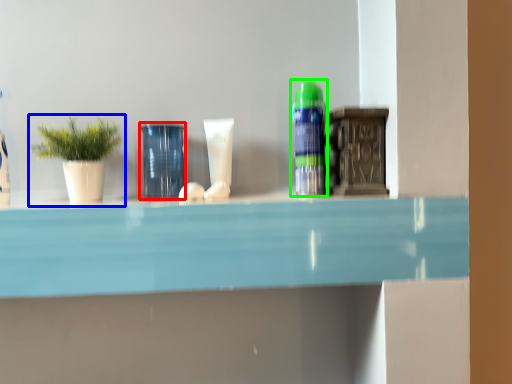
Question: Which object is the farthest from glass vase (highlighted by a red box)? Choose among these: houseplant (highlighted by a blue box) or toiletry (highlighted by a green box).

Choices:
 (A) houseplant
 (B) toiletry

Answer: (B)